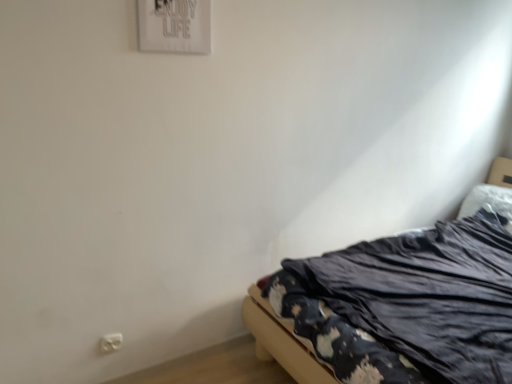
Question: Considering the positions of white plastic electric outlet at lower left and dark fabric bed at lower right in the image, is white plastic electric outlet at lower left bigger or smaller than dark fabric bed at lower right?

Choices:
 (A) small
 (B) big

Answer: (A)

Question: From a real-world perspective, is white plastic electric outlet at lower left positioned above or below dark fabric bed at lower right?

Choices:
 (A) above
 (B) below

Answer: (B)

Question: Considering the positions of white plastic electric outlet at lower left and dark fabric bed at lower right in the image, is white plastic electric outlet at lower left taller or shorter than dark fabric bed at lower right?

Choices:
 (A) short
 (B) tall

Answer: (A)

Question: From their relative heights in the image, would you say dark fabric bed at lower right is taller or shorter than white plastic electric outlet at lower left?

Choices:
 (A) tall
 (B) short

Answer: (A)

Question: Is point (428, 273) closer or farther from the camera than point (117, 332)?

Choices:
 (A) farther
 (B) closer

Answer: (A)

Question: Would you say dark fabric bed at lower right is inside or outside white plastic electric outlet at lower left?

Choices:
 (A) inside
 (B) outside

Answer: (B)

Question: Is dark fabric bed at lower right in front of or behind white plastic electric outlet at lower left in the image?

Choices:
 (A) front
 (B) behind

Answer: (A)